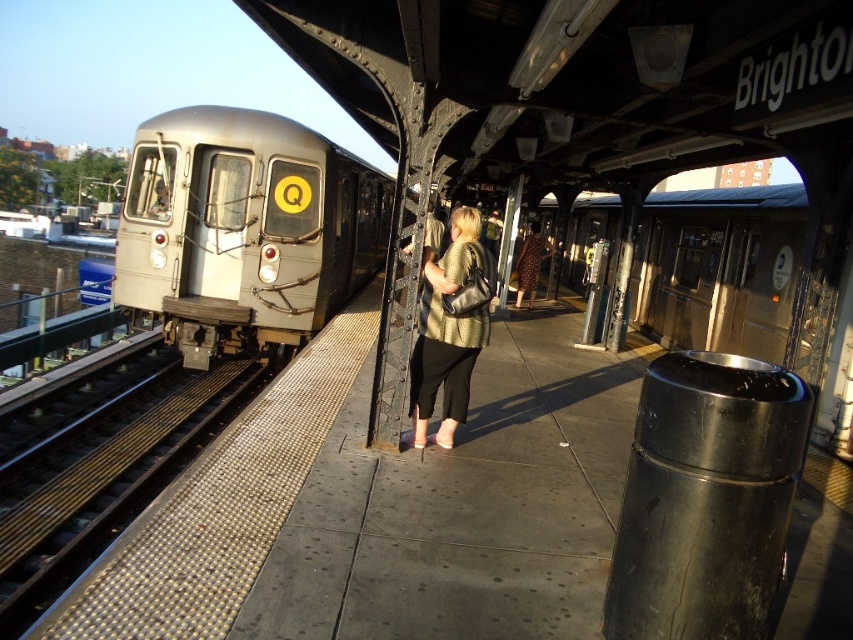
Question: Is metallic gold blouse at center below brown dotted dress at center?

Choices:
 (A) no
 (B) yes

Answer: (B)

Question: Estimate the real-world distances between objects in this image. Which object is farther from the metallic gray train at left?

Choices:
 (A) silver metallic train at left
 (B) metal/textured train track at left

Answer: (A)

Question: From the image, what is the correct spatial relationship of metallic gold blouse at center in relation to brown dotted dress at center?

Choices:
 (A) below
 (B) above

Answer: (A)

Question: Among these objects, which one is farthest from the camera?

Choices:
 (A) metallic gray train at left
 (B) brown dotted dress at center
 (C) metal/textured train track at left

Answer: (B)

Question: Does metal/textured train track at left appear on the right side of brown dotted dress at center?

Choices:
 (A) no
 (B) yes

Answer: (A)

Question: Among these objects, which one is nearest to the camera?

Choices:
 (A) brown dotted dress at center
 (B) silver metallic train at left
 (C) metallic gray train at left

Answer: (B)